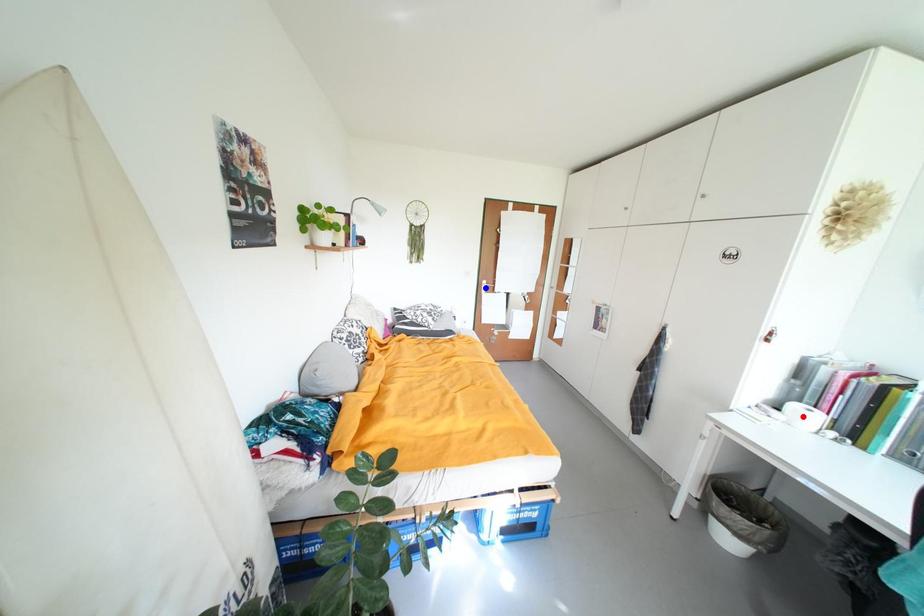
Question: In the image, two points are highlighted. Which point is nearer to the camera? Reply with the corresponding letter.

Choices:
 (A) blue point
 (B) red point

Answer: (B)